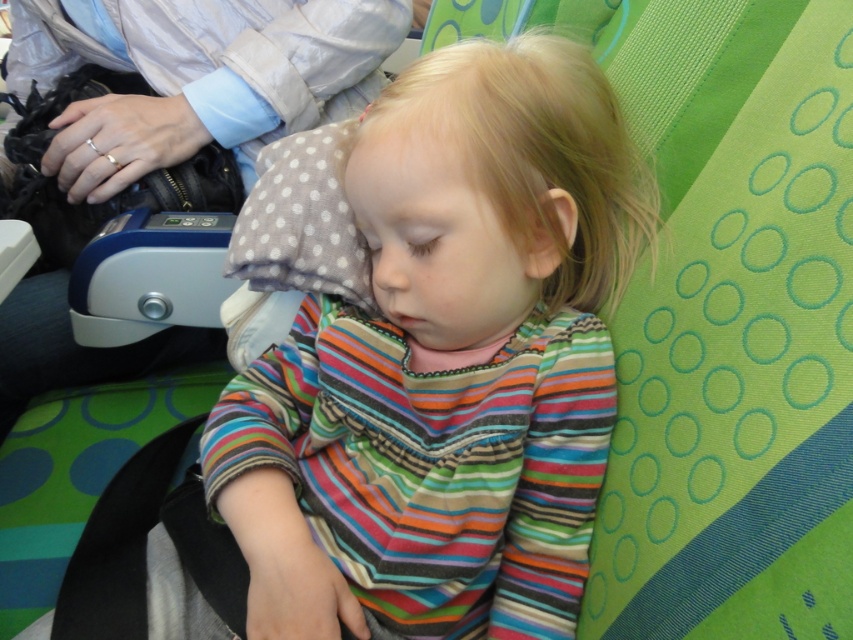
You are a tailor measuring clothing items for alterations. You see the striped cotton shirt at center and the gray dotted pillow at center. Which item is taller?

The striped cotton shirt at center is much taller than the gray dotted pillow at center.

You are a passenger on a train and notice the striped cotton shirt at center and the gray dotted pillow at center. Which object is positioned lower in the scene?

The striped cotton shirt at center is below the gray dotted pillow at center, so the striped cotton shirt at center is positioned lower in the scene.

You are a photographer trying to capture a closeup of the striped cotton shirt at center without the gray dotted pillow at center appearing in the background. Is this possible based on their current positions?

Yes, since the striped cotton shirt at center is in front of the gray dotted pillow at center, you can adjust your angle to focus on the shirt and exclude the pillow from the frame.